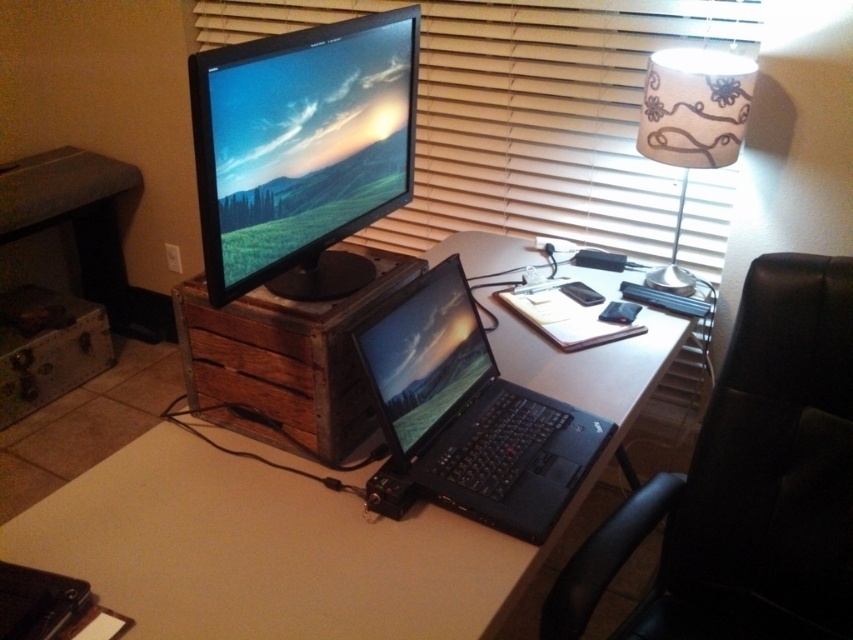
Question: Is white wood computer desk at center further to camera compared to black glossy laptop at center?

Choices:
 (A) yes
 (B) no

Answer: (B)

Question: Which point is closer to the camera?

Choices:
 (A) white wood computer desk at center
 (B) wooden blinds at upper center
 (C) white fabric lampshade at upper right

Answer: (A)

Question: Which object is closer to the camera taking this photo?

Choices:
 (A) black matte laptop at center
 (B) white wood computer desk at center
 (C) wooden blinds at upper center
 (D) wooden drawer at center

Answer: (B)

Question: Among these objects, which one is farthest from the camera?

Choices:
 (A) black matte laptop at center
 (B) white fabric lampshade at upper right
 (C) white wood computer desk at center

Answer: (B)

Question: Is black leather swivel chair at right in front of black matte laptop at center?

Choices:
 (A) no
 (B) yes

Answer: (B)

Question: Can you confirm if white wood computer desk at center is positioned to the left of wooden blinds at upper center?

Choices:
 (A) yes
 (B) no

Answer: (B)